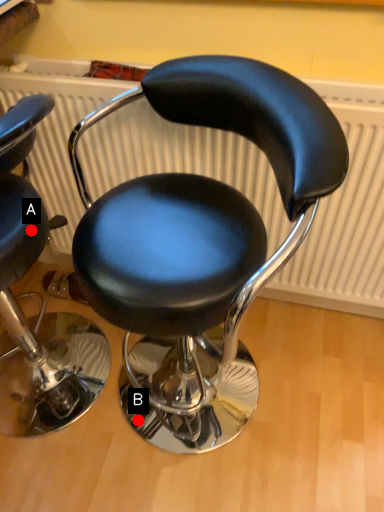
Question: Two points are circled on the image, labeled by A and B beside each circle. Which point is farther from the camera taking this photo?

Choices:
 (A) A is further
 (B) B is further

Answer: (B)